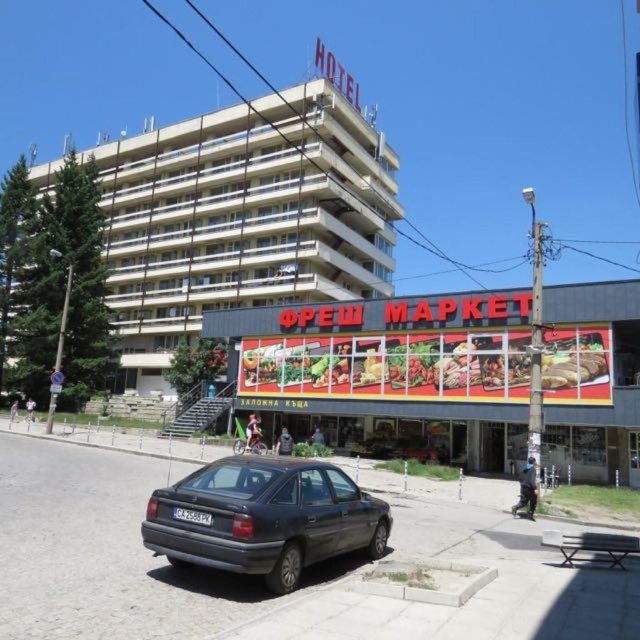
You are standing on the sidewalk in front of the Fresh Market and want to take a photo of the beige concrete building at upper center without including the matte dark gray sedan at lower center in the frame. Is this possible given their positions?

The beige concrete building at upper center is located above the matte dark gray sedan at lower center. Therefore, you can take a photo of the beige concrete building at upper center by angling the camera upwards to exclude the matte dark gray sedan at lower center since it is positioned below the building.

You are standing at the origin point of the coordinate system. You want to walk to the beige concrete building at upper center. Which direction should you go?

The beige concrete building at upper center is located at coordinate point (241,218), so you should move northeast to reach it.

You are standing at the point marked by the coordinate point (241,218) in the image. Looking around, you see the beige concrete building at upper center. What is the nearest landmark to you in this urban scene?

The nearest landmark to the point marked by the coordinate point (241,218) is the beige concrete building at upper center, as the point marks its location.